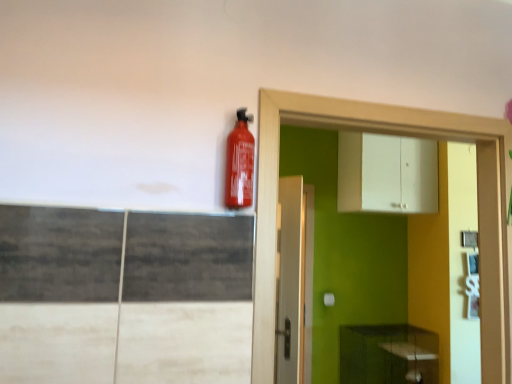
Question: Looking at the image, does white matte cabinet at upper center, which is the first cabinetry in top-to-bottom order, seem bigger or smaller compared to white glossy dresser at upper right?

Choices:
 (A) small
 (B) big

Answer: (B)

Question: Does point (376, 160) appear closer or farther from the camera than point (403, 109)?

Choices:
 (A) farther
 (B) closer

Answer: (A)

Question: Based on their relative distances, which object is farther from the matte red extinguisher at upper center?

Choices:
 (A) green matte cabinet at lower right, which appears as the 1th cabinetry when ordered from the bottom
 (B) white matte cabinet at upper center, which is the first cabinetry in top-to-bottom order
 (C) white glossy dresser at upper right

Answer: (A)

Question: Estimate the real-world distances between objects in this image. Which object is closer to the white matte cabinet at upper center, which is the first cabinetry in top-to-bottom order?

Choices:
 (A) green matte cabinet at lower right, which appears as the 1th cabinetry when ordered from the bottom
 (B) matte red extinguisher at upper center
 (C) white glossy dresser at upper right

Answer: (A)